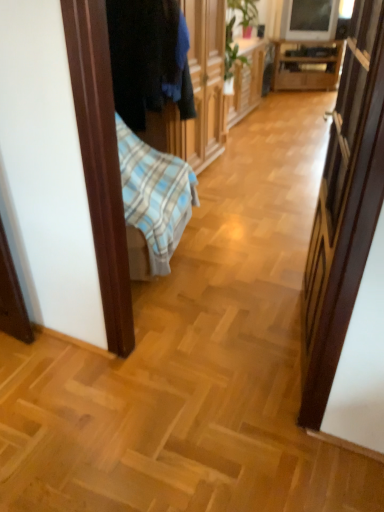
Question: From the image's perspective, is wooden cabinet at center above wooden cabinet at center?

Choices:
 (A) yes
 (B) no

Answer: (B)

Question: Can you confirm if wooden cabinet at center is smaller than wooden cabinet at center?

Choices:
 (A) no
 (B) yes

Answer: (A)

Question: Is wooden cabinet at center facing towards wooden cabinet at center?

Choices:
 (A) yes
 (B) no

Answer: (B)

Question: Is wooden cabinet at center thinner than wooden cabinet at center?

Choices:
 (A) yes
 (B) no

Answer: (A)

Question: Considering the relative sizes of wooden cabinet at center and wooden cabinet at center in the image provided, is wooden cabinet at center taller than wooden cabinet at center?

Choices:
 (A) yes
 (B) no

Answer: (A)

Question: Is wooden cabinet at center wider or thinner than dark blue fabric at left?

Choices:
 (A) wide
 (B) thin

Answer: (B)

Question: Is point (327, 56) closer or farther from the camera than point (119, 46)?

Choices:
 (A) closer
 (B) farther

Answer: (B)

Question: From the image's perspective, is wooden cabinet at center positioned above or below dark blue fabric at left?

Choices:
 (A) below
 (B) above

Answer: (B)

Question: In terms of height, does wooden cabinet at center look taller or shorter compared to dark blue fabric at left?

Choices:
 (A) tall
 (B) short

Answer: (B)

Question: Is wooden cabinet at center wider or thinner than wooden cabinet at center?

Choices:
 (A) thin
 (B) wide

Answer: (A)

Question: From a real-world perspective, is wooden cabinet at center positioned above or below wooden cabinet at center?

Choices:
 (A) above
 (B) below

Answer: (A)

Question: From their relative heights in the image, would you say wooden cabinet at center is taller or shorter than wooden cabinet at center?

Choices:
 (A) tall
 (B) short

Answer: (A)

Question: Would you say wooden cabinet at center is inside or outside wooden cabinet at center?

Choices:
 (A) outside
 (B) inside

Answer: (A)

Question: From a real-world perspective, is wooden cabinet at center positioned above or below wooden cabinet at center?

Choices:
 (A) above
 (B) below

Answer: (B)

Question: Looking at their shapes, would you say wooden cabinet at center is wider or thinner than wooden cabinet at center?

Choices:
 (A) wide
 (B) thin

Answer: (A)